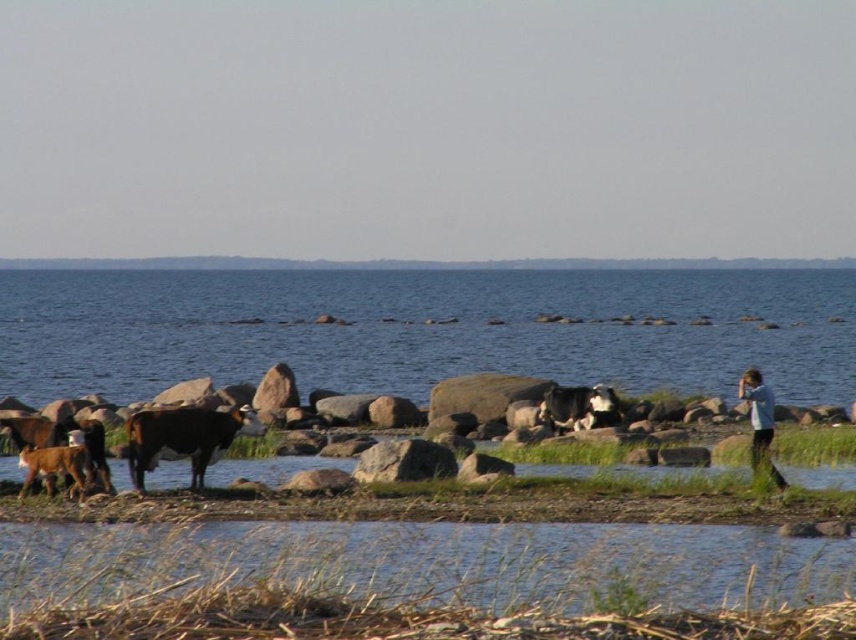
You are a photographer trying to capture a group of cows and a person in a coastal scene. You notice the brown glossy cow at center and the blue shirt at right. Which of these two is narrower in width?

The brown glossy cow at center is thinner than the blue shirt at right, so the brown glossy cow at center is narrower in width.

Based on the scene description, where exactly is the blue water at center located in the image?

The blue water at center is located at point coordinates of [424,330].

Based on the photo, you are a photographer trying to capture the entire scene of the blue water at center and the blue shirt at right in one shot. Which object should you focus on first to ensure both are in frame?

The blue water at center is wider than the blue shirt at right, so you should focus on the blue water at center first to ensure both fit in the frame.